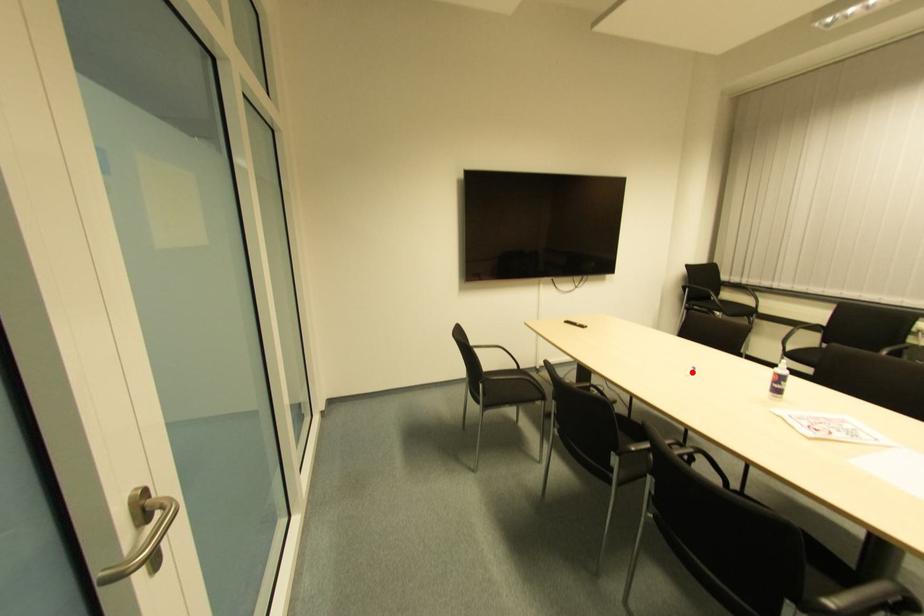
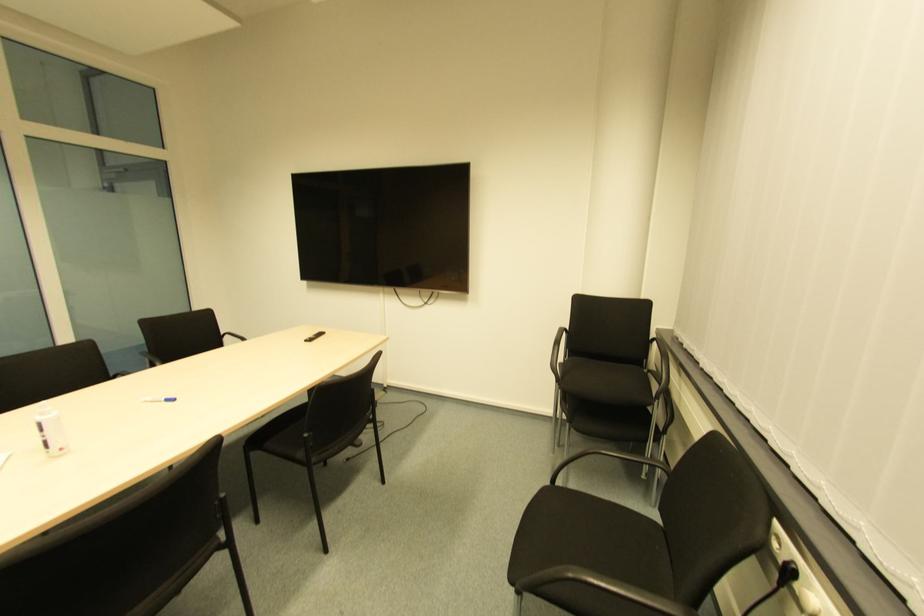
In the second image, find the point that corresponds to the highlighted location in the first image.

(172, 403)